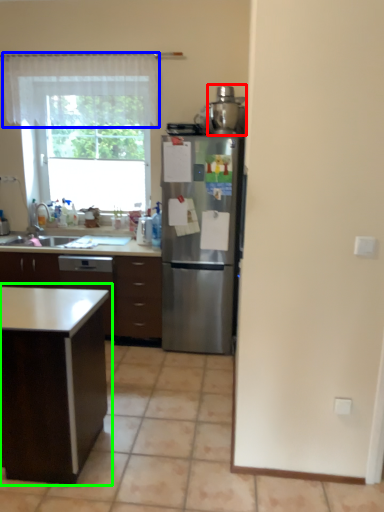
Question: Based on their relative distances, which object is nearer to appliance (highlighted by a red box)? Choose from curtain (highlighted by a blue box) and table (highlighted by a green box).

Choices:
 (A) curtain
 (B) table

Answer: (A)